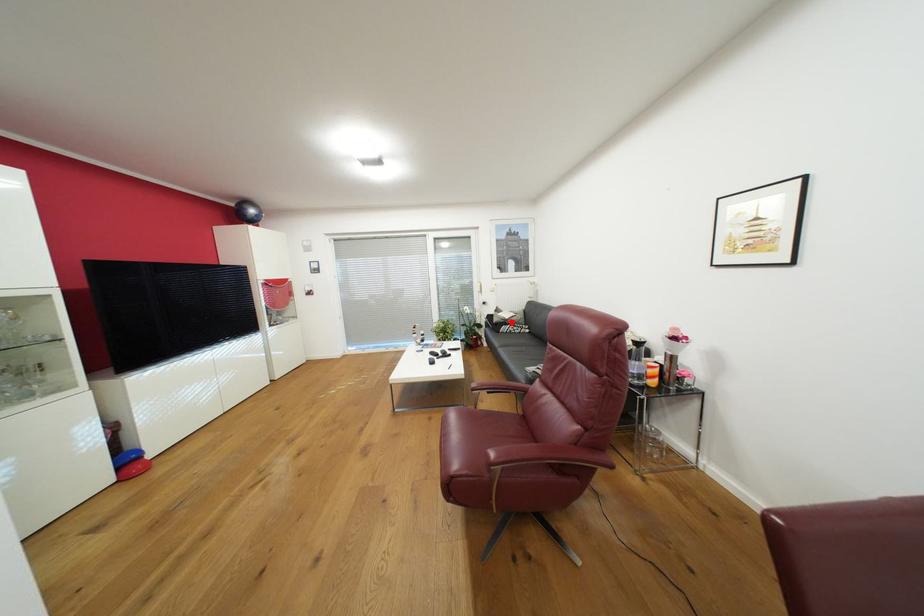
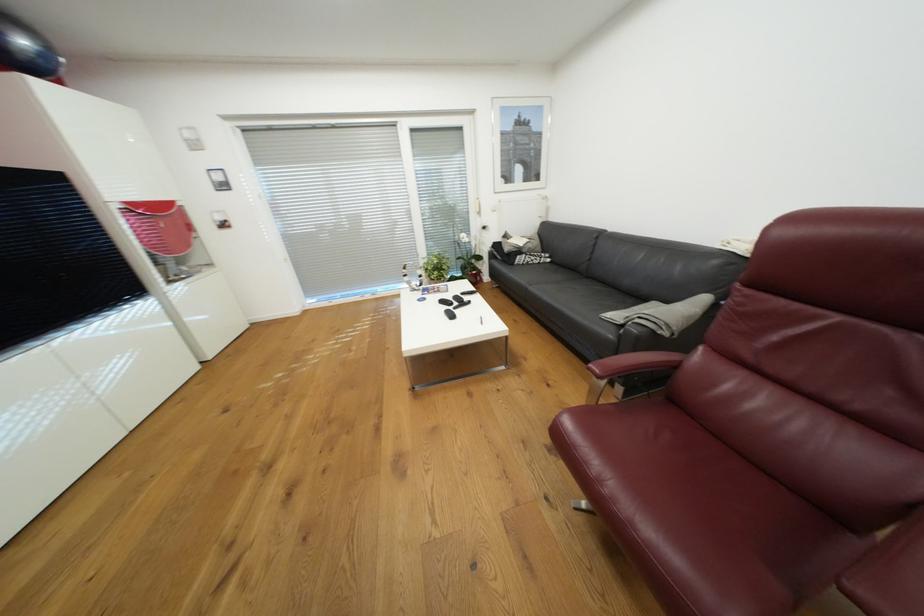
Question: I am providing you with two images of the same scene from different viewpoints. In image1, a red point is highlighted. Considering the same 3D point in image2, which of the following is correct?

Choices:
 (A) It is closer
 (B) It is farther

Answer: (A)